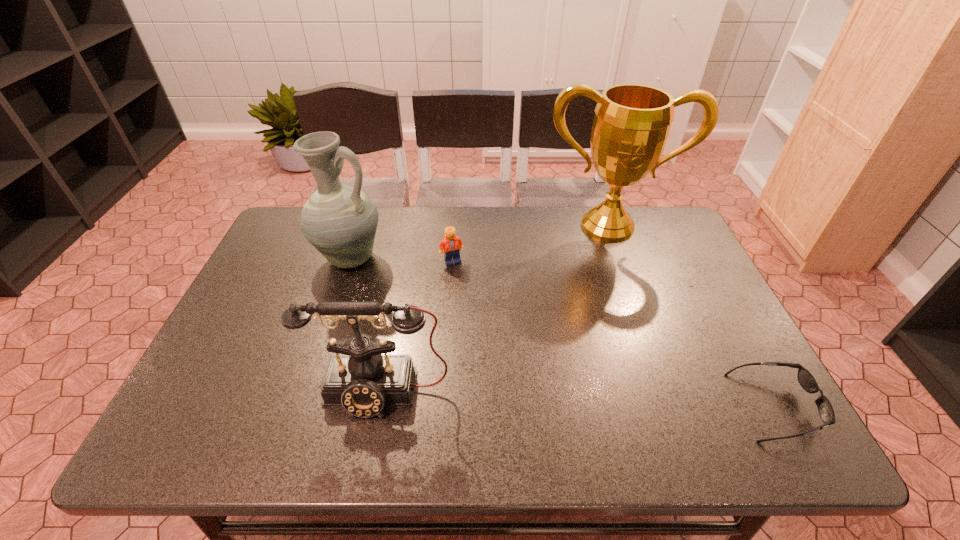
Where is `the third shortest object`? The height and width of the screenshot is (540, 960). the third shortest object is located at coordinates (363, 381).

Locate an element on the screen. sunglasses is located at coordinates (805, 378).

Where is `Lego`? This screenshot has width=960, height=540. Lego is located at coordinates (451, 244).

Where is `award`? The height and width of the screenshot is (540, 960). award is located at coordinates (632, 122).

You are a GUI agent. You are given a task and a screenshot of the screen. Output one action in this format:
    pyautogui.click(x=<x>, y=<y>)
    Task: Click on the second tallest object
    Image resolution: width=960 pixels, height=540 pixels.
    Given the screenshot: What is the action you would take?
    pyautogui.click(x=340, y=221)

This screenshot has height=540, width=960. I want to click on vacant space located on the front-facing side of the Lego, so click(529, 326).

At what (x,y) coordinates should I click in order to perform the action: click on free space located 0.220m on the front-facing side of the Lego. Please return your answer as a coordinate pair (x, y). Looking at the image, I should click on (509, 308).

Find the location of a particular element. free space located 0.120m on the front-facing side of the Lego is located at coordinates (486, 287).

Where is `free point located 0.280m on the front-facing side of the award`? free point located 0.280m on the front-facing side of the award is located at coordinates (610, 310).

You are a GUI agent. You are given a task and a screenshot of the screen. Output one action in this format:
    pyautogui.click(x=<x>, y=<y>)
    Task: Click on the vacant region located on the front-facing side of the award
    This screenshot has width=960, height=540.
    Given the screenshot: What is the action you would take?
    pyautogui.click(x=611, y=322)